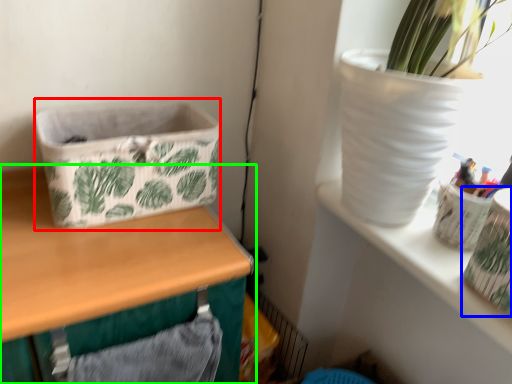
Question: Which is farther away from basket container (highlighted by a red box)? vase (highlighted by a blue box) or table (highlighted by a green box)?

Choices:
 (A) vase
 (B) table

Answer: (A)